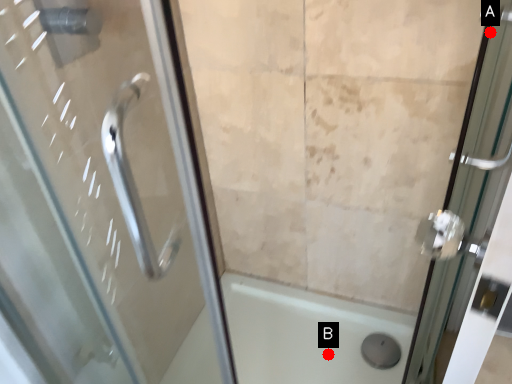
Question: Two points are circled on the image, labeled by A and B beside each circle. Which point appears farthest from the camera in this image?

Choices:
 (A) A is further
 (B) B is further

Answer: (B)